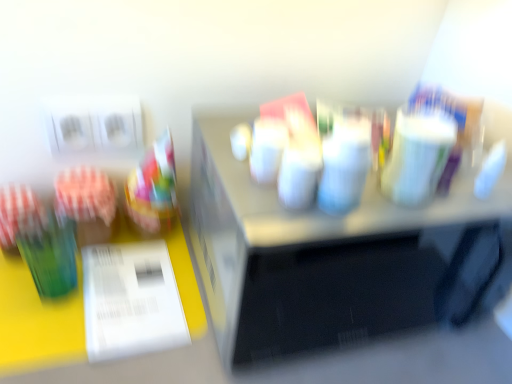
Locate an element on the screen. vacant region above white glossy paper at lower left (from a real-world perspective) is located at coordinates (127, 284).